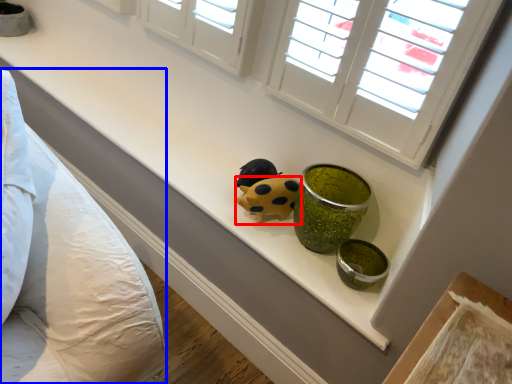
Question: Which object is further to the camera taking this photo, ladybug (highlighted by a red box) or bedding (highlighted by a blue box)?

Choices:
 (A) ladybug
 (B) bedding

Answer: (A)